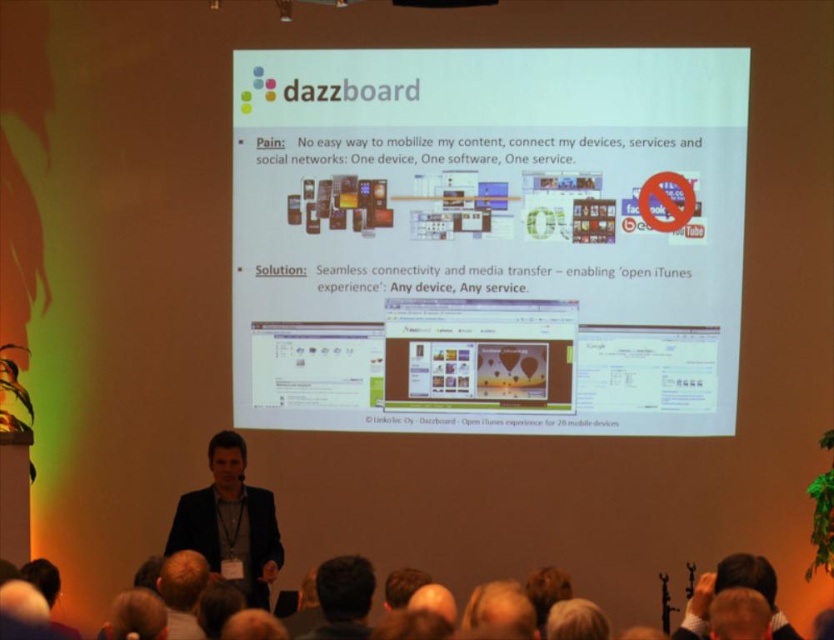
Question: Is white glossy projector screen at center to the left of dark brown hair at lower center from the viewer's perspective?

Choices:
 (A) yes
 (B) no

Answer: (B)

Question: Which point appears closest to the camera in this image?

Choices:
 (A) (737, 56)
 (B) (430, 6)

Answer: (B)

Question: Does white glossy projector screen at center have a larger size compared to black suit at center?

Choices:
 (A) no
 (B) yes

Answer: (B)

Question: Considering the relative positions of dark suit at lower left and black suit at center in the image provided, where is dark suit at lower left located with respect to black suit at center?

Choices:
 (A) above
 (B) below

Answer: (B)

Question: Which point is closer to the camera?

Choices:
 (A) [x=486, y=4]
 (B) [x=322, y=620]
 (C) [x=578, y=124]

Answer: (B)

Question: Based on their relative distances, which object is nearer to the white glossy projector screen at center?

Choices:
 (A) dark brown hair at lower center
 (B) dark suit at lower left
 (C) black suit at center

Answer: (C)